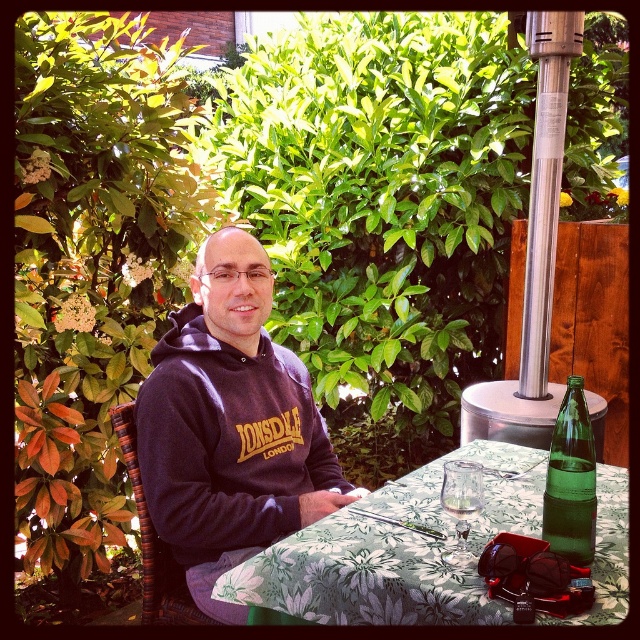
Question: Which object is farther from the camera taking this photo?

Choices:
 (A) green glass bottle at right
 (B) dark gray hoodie at center

Answer: (B)

Question: Does green glass bottle at right lie behind clear glass wine glass at table center?

Choices:
 (A) yes
 (B) no

Answer: (B)

Question: Which object is positioned closest to the green glass bottle at right?

Choices:
 (A) clear glass wine glass at table center
 (B) floral fabric table at center

Answer: (A)

Question: Which of these objects is positioned closest to the floral fabric table at center?

Choices:
 (A) dark gray hoodie at center
 (B) green glass bottle at right
 (C) clear glass wine glass at table center

Answer: (C)

Question: Is dark gray hoodie at center to the left of floral fabric table at center from the viewer's perspective?

Choices:
 (A) no
 (B) yes

Answer: (B)

Question: From the image, what is the correct spatial relationship of floral fabric table at center in relation to clear glass wine glass at table center?

Choices:
 (A) left
 (B) right

Answer: (B)